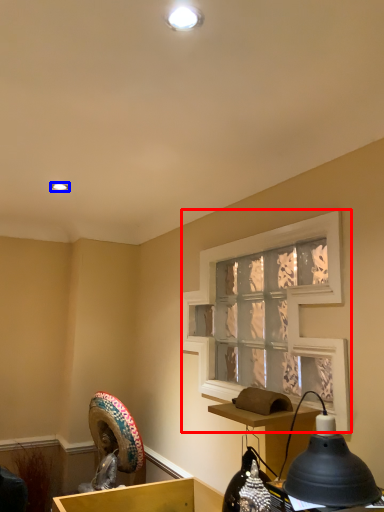
Question: Which object is further to the camera taking this photo, window screen (highlighted by a red box) or light (highlighted by a blue box)?

Choices:
 (A) window screen
 (B) light

Answer: (B)